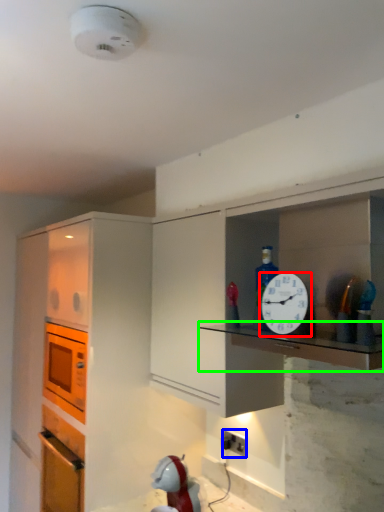
Question: Based on their relative distances, which object is nearer to clock (highlighted by a red box)? Choose from electric outlet (highlighted by a blue box) and counter top (highlighted by a green box).

Choices:
 (A) electric outlet
 (B) counter top

Answer: (B)